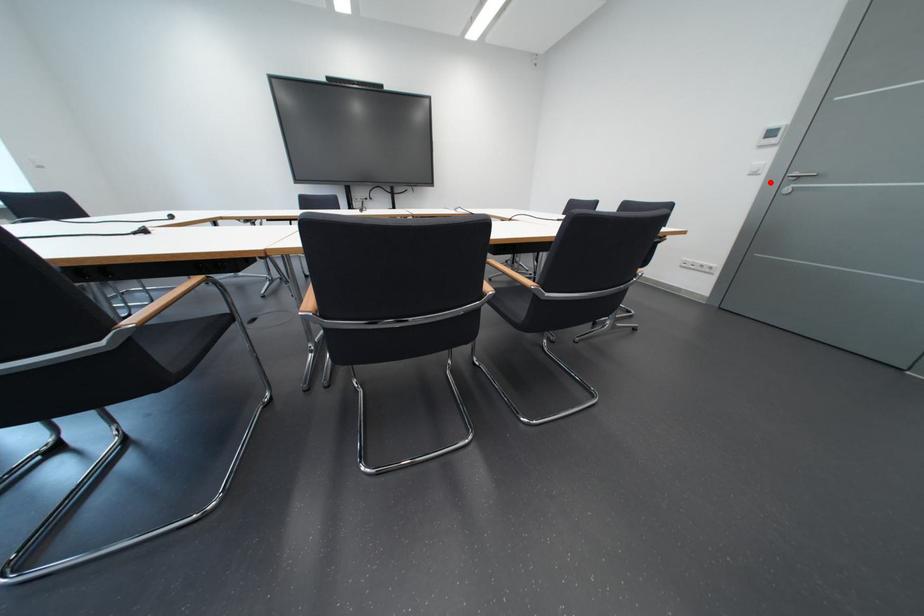
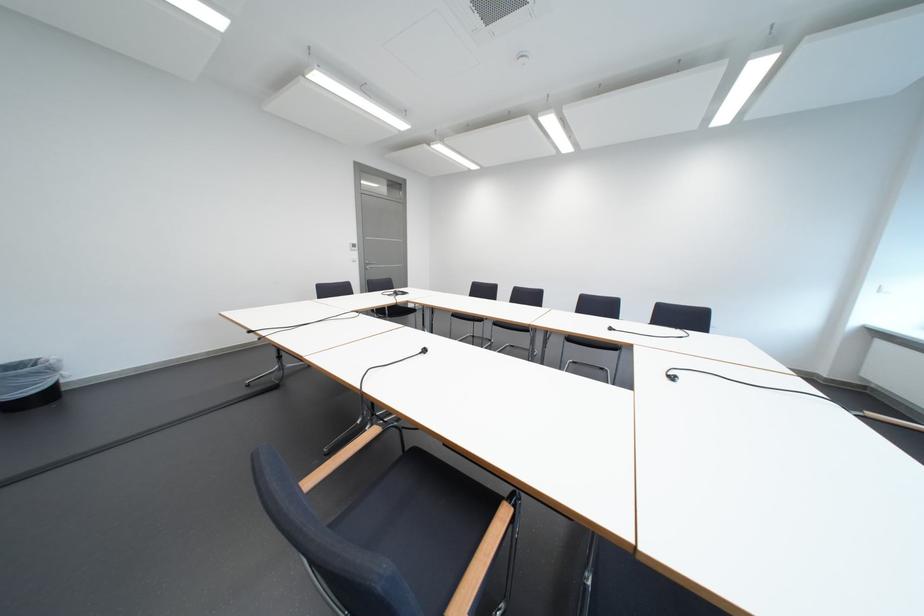
Question: I am providing you with two images of the same scene from different viewpoints. Given a red point in image1, look at the same physical point in image2. Is it:

Choices:
 (A) Closer to the viewpoint
 (B) Farther from the viewpoint

Answer: (A)